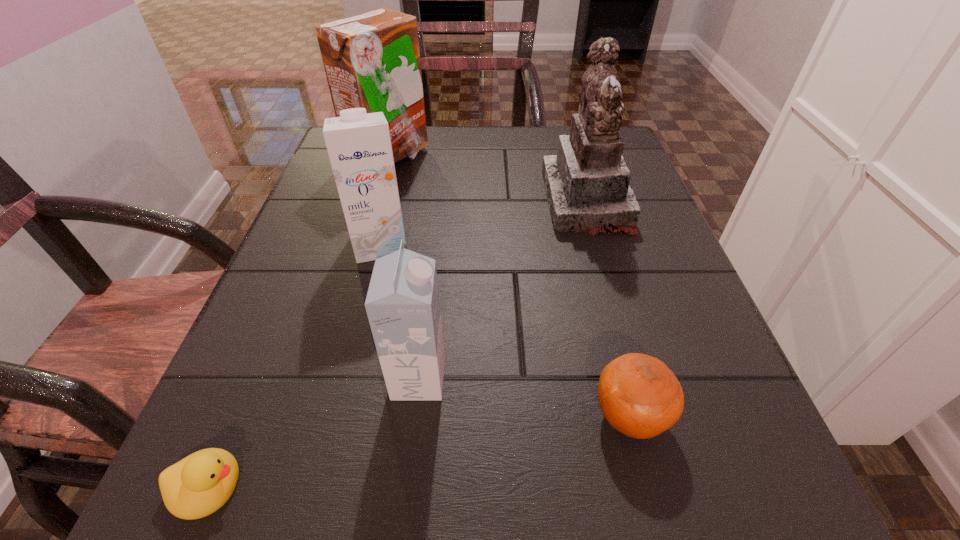
Identify the location of free spot that satisfies the following two spatial constraints: 1. on the front label of the orange; 2. on the left side of the nearest carton. (414, 417).

Locate an element on the screen. The image size is (960, 540). free spot that satisfies the following two spatial constraints: 1. on the back side of the orange; 2. on the front label of the rightmost carton is located at coordinates (619, 379).

I want to click on free location that satisfies the following two spatial constraints: 1. on the front side of the second shortest object; 2. on the face of the shortest object, so click(x=647, y=487).

Locate an element on the screen. Image resolution: width=960 pixels, height=540 pixels. vacant area that satisfies the following two spatial constraints: 1. on the straw side of the farthest carton; 2. on the right side of the second shortest object is located at coordinates (313, 417).